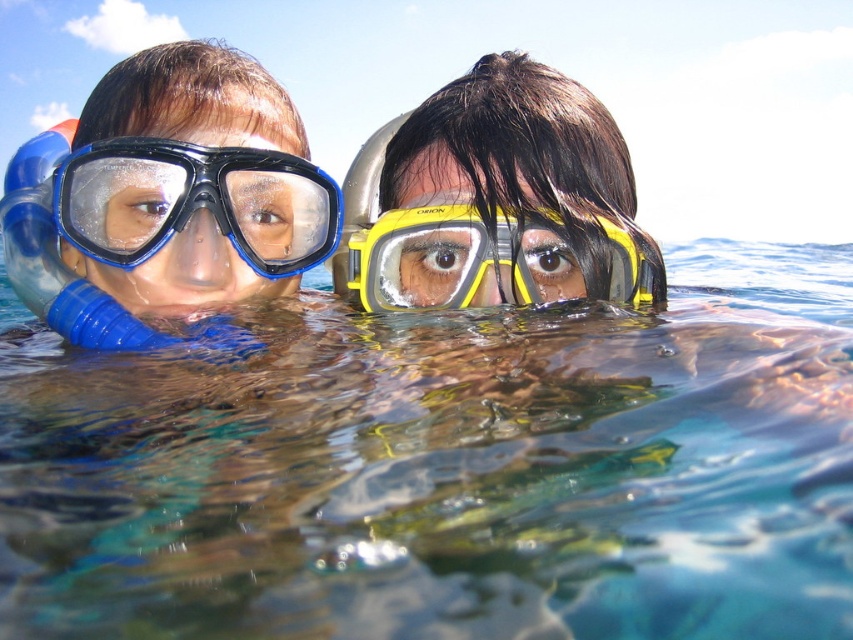
Does clear blue water at center appear on the left side of blue tempered glass goggles at left?

In fact, clear blue water at center is to the right of blue tempered glass goggles at left.

Is point (289, 342) closer to viewer compared to point (231, 193)?

Yes.

At what (x,y) coordinates should I click in order to perform the action: click on clear blue water at center. Please return your answer as a coordinate pair (x, y). The image size is (853, 640). Looking at the image, I should click on (450, 474).

Which is below, blue tempered glass goggles at left or yellow matte snorkel mask at center?

yellow matte snorkel mask at center

Can you confirm if blue tempered glass goggles at left is wider than yellow matte snorkel mask at center?

Incorrect, blue tempered glass goggles at left's width does not surpass yellow matte snorkel mask at center's.

Is point (283, 170) in front of point (463, 266)?

No, it is behind (463, 266).

What are the coordinates of `blue tempered glass goggles at left` in the screenshot? It's located at (195, 202).

Which is more to the right, clear blue water at center or yellow matte snorkel mask at center?

Positioned to the right is yellow matte snorkel mask at center.

Measure the distance between clear blue water at center and camera.

clear blue water at center and camera are 15.78 inches apart from each other.

This screenshot has width=853, height=640. Find the location of `clear blue water at center`. clear blue water at center is located at coordinates (450, 474).